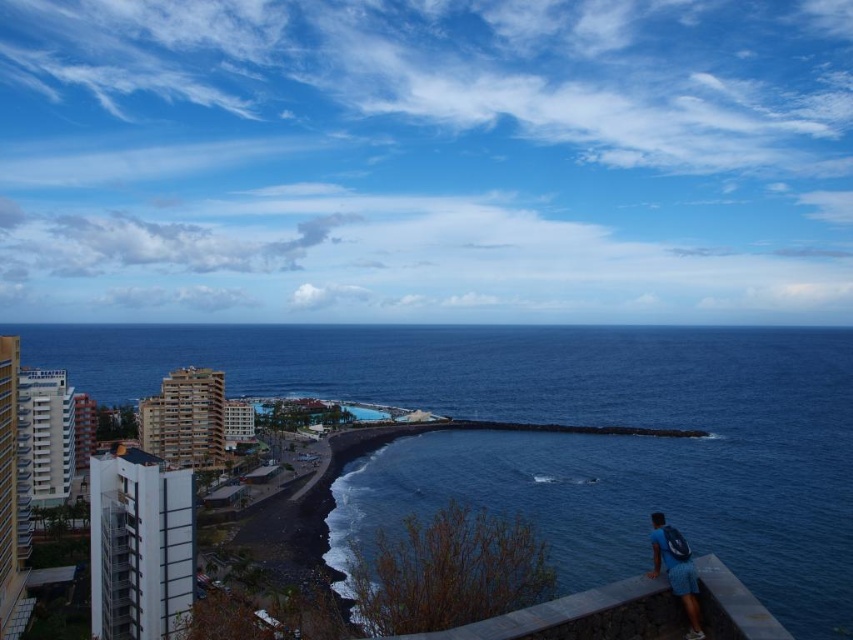
Can you confirm if blue water at center is smaller than blue fabric backpack at lower right?

Incorrect, blue water at center is not smaller in size than blue fabric backpack at lower right.

Is blue water at center shorter than blue fabric backpack at lower right?

In fact, blue water at center may be taller than blue fabric backpack at lower right.

Locate an element on the screen. blue water at center is located at coordinates (561, 435).

Which is below, gray concrete ledge at lower right or blue fabric backpack at lower right?

gray concrete ledge at lower right

Does gray concrete ledge at lower right come in front of blue fabric backpack at lower right?

Yes, gray concrete ledge at lower right is closer to the viewer.

In the scene shown: Who is more forward, (415, 634) or (688, 600)?

Positioned in front is point (415, 634).

Locate an element on the screen. gray concrete ledge at lower right is located at coordinates (582, 616).

Between blue water at center and gray concrete ledge at lower right, which one appears on the left side from the viewer's perspective?

blue water at center

This screenshot has width=853, height=640. I want to click on blue water at center, so click(561, 435).

Where is `blue water at center`? The width and height of the screenshot is (853, 640). blue water at center is located at coordinates (561, 435).